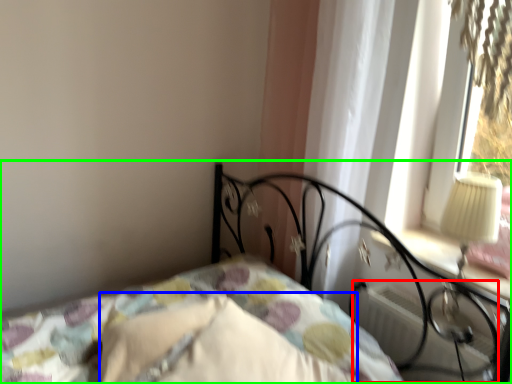
Question: Which object is the closest to the radiator (highlighted by a red box)? Choose among these: pillow (highlighted by a blue box) or bed (highlighted by a green box).

Choices:
 (A) pillow
 (B) bed

Answer: (B)